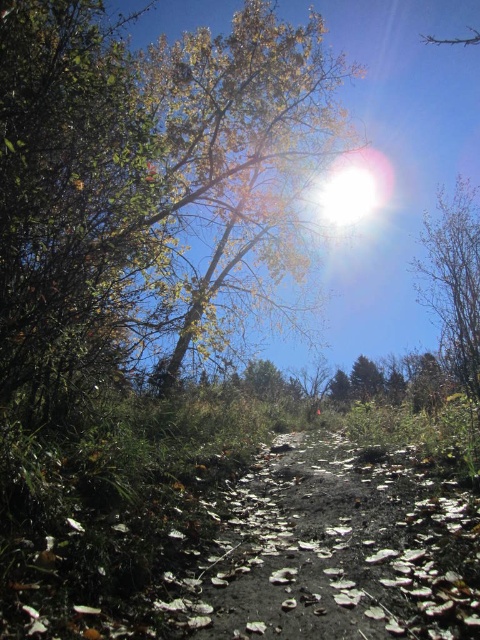
You are a hiker carrying a backpack and need to walk from the brown dirt path at center to the bare branches at right. The path is narrow and you can only walk straight. Is there enough space for you to pass through without deviating from the path?

The distance between the brown dirt path at center and the bare branches at right is 41.56 feet, which is more than enough space for a hiker to pass through without deviating from the path.

Based on the photo, you are a hiker standing at the start of the brown dirt path at center. You want to reach a viewpoint located at the end of the path. As you walk along the path, will you pass under the bare branches at right?

Yes, the brown dirt path at center is located below the bare branches at right, so you will pass under them as you walk along the path.